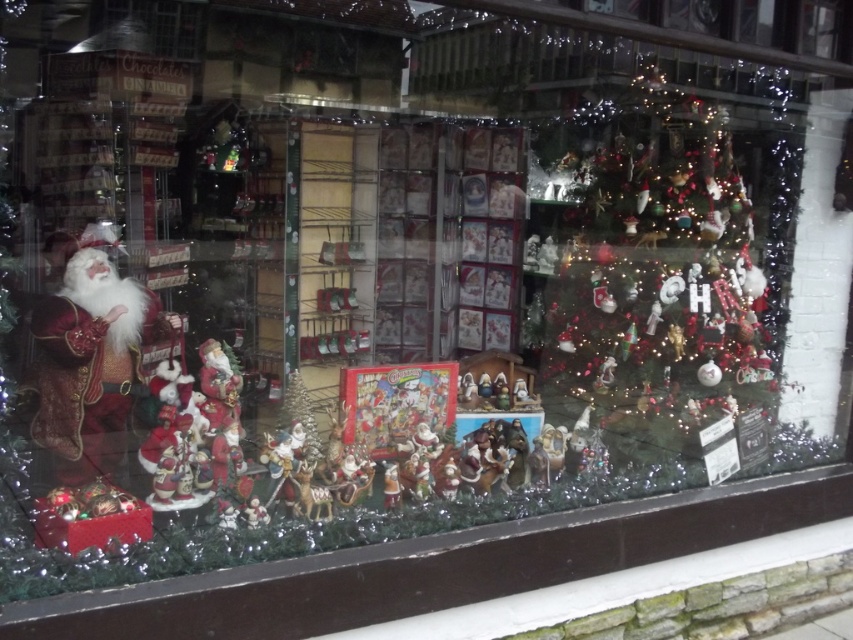
Question: Can you confirm if iridescent glass ornaments at upper right is positioned to the right of velvet red santa claus at left?

Choices:
 (A) yes
 (B) no

Answer: (A)

Question: Among these objects, which one is farthest from the camera?

Choices:
 (A) velvet red santa claus at left
 (B) iridescent glass ornaments at upper right

Answer: (B)

Question: Does iridescent glass ornaments at upper right have a smaller size compared to velvet red santa claus at left?

Choices:
 (A) no
 (B) yes

Answer: (A)

Question: Which of the following is the farthest from the observer?

Choices:
 (A) (704, 392)
 (B) (73, 387)

Answer: (A)

Question: Can you confirm if iridescent glass ornaments at upper right is thinner than velvet red santa claus at left?

Choices:
 (A) yes
 (B) no

Answer: (B)